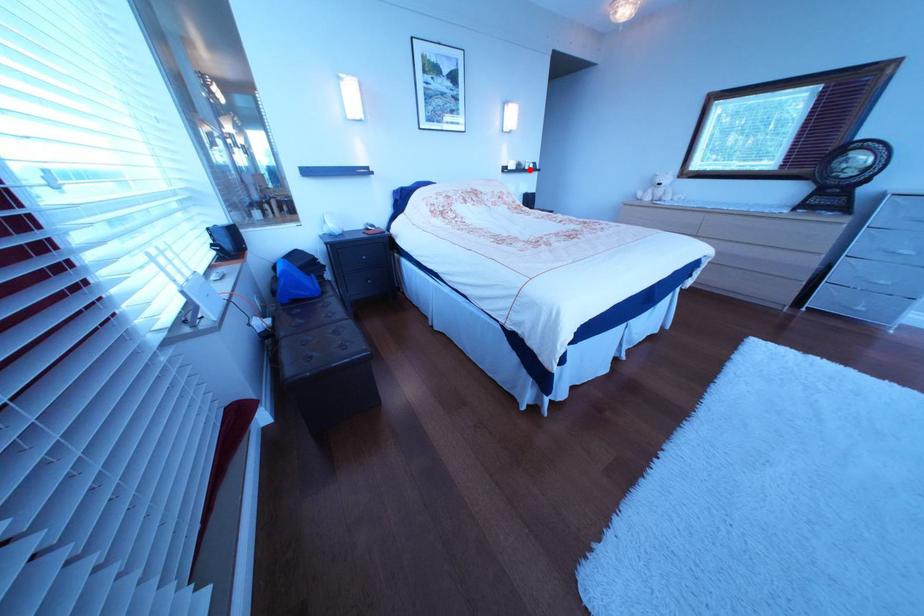
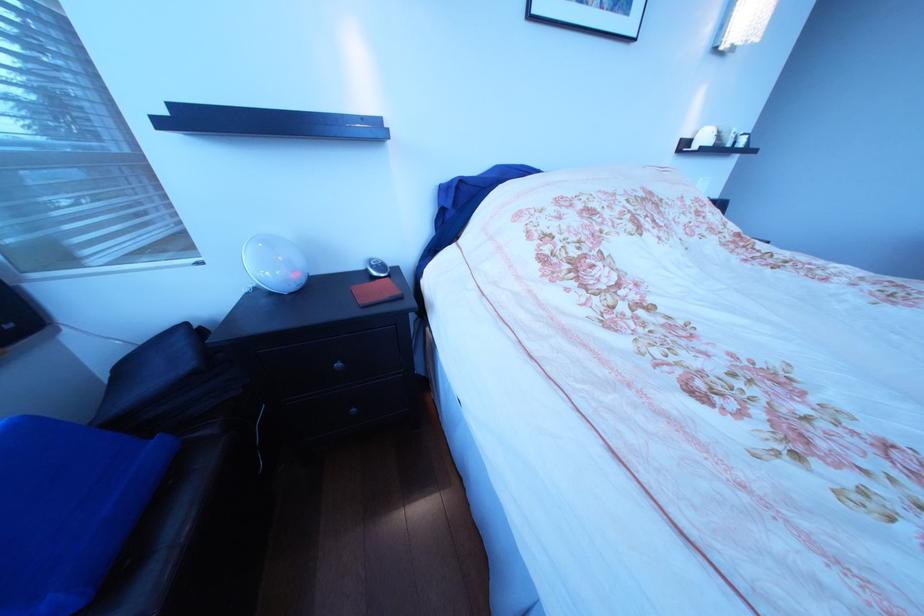
Where in the second image is the point corresponding to the highlighted location from the first image?

(724, 146)